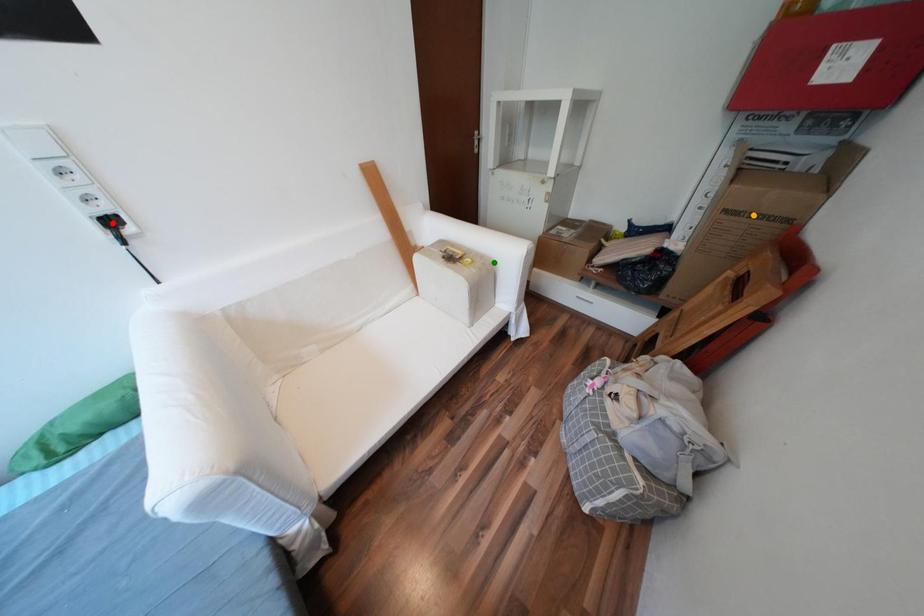
Order these from nearest to farthest:
orange point, green point, red point

green point → orange point → red point